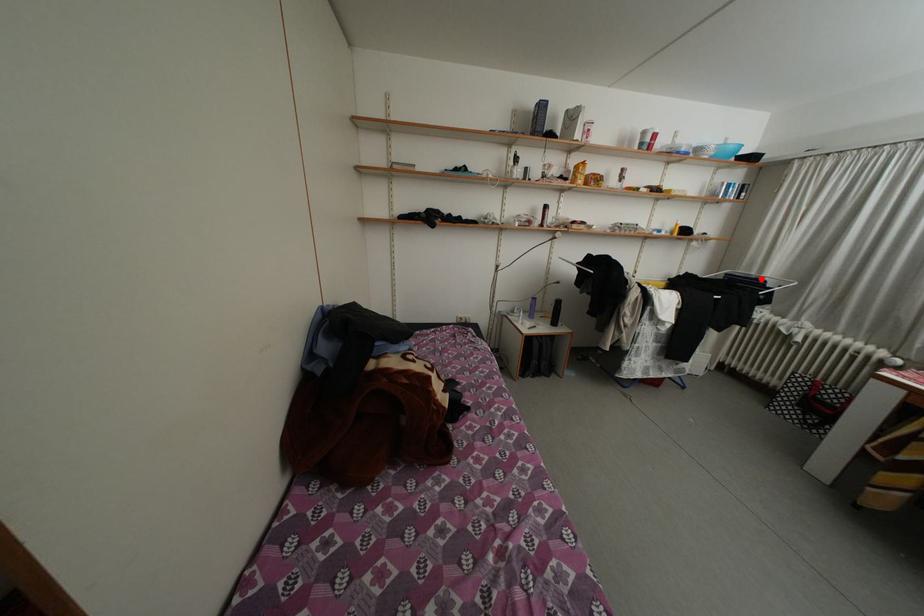
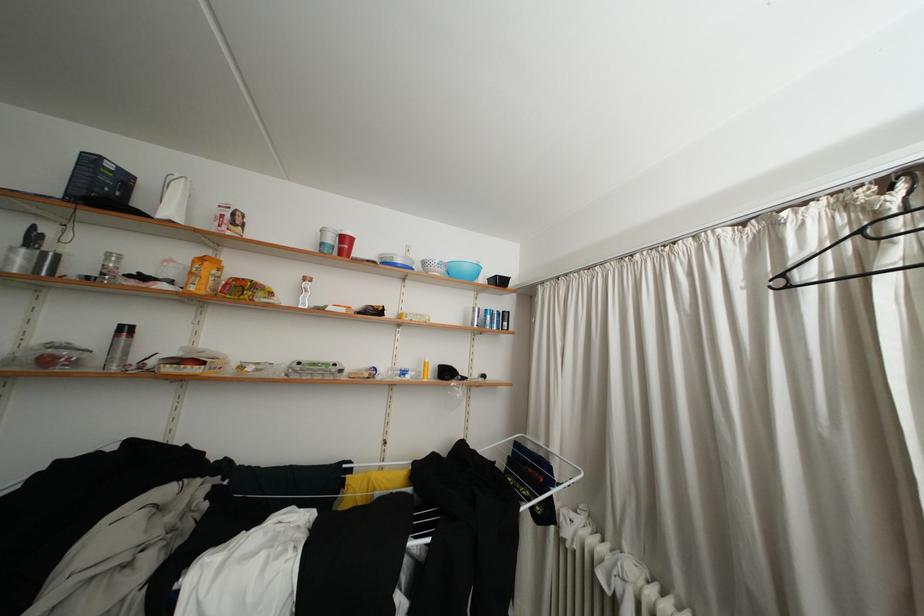
In the second image, find the point that corresponds to the highlighted location in the first image.

(550, 448)